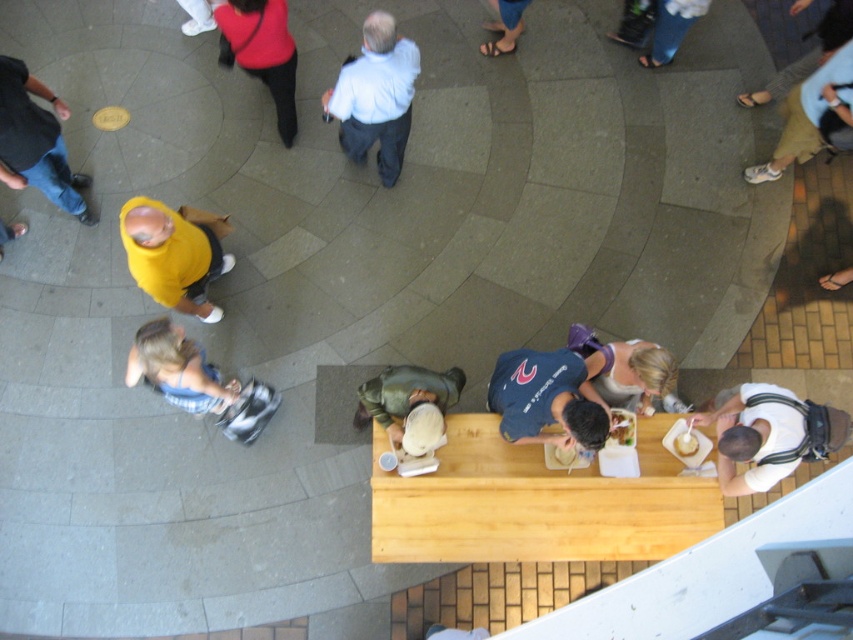
You are standing on the balcony looking down at the public square. You notice the denim shorts at lower left and the white paper cupcake at lower right. Which object is closer to you?

The denim shorts at lower left is closer to the viewer than the white paper cupcake at lower right.

You are standing on the balcony looking down at the public square. You notice a white cotton shirt at lower right and a blonde hair woman at center. Which one appears bigger in size?

The white cotton shirt at lower right has a larger size compared to the blonde hair woman at center.

You are standing at the edge of the public square and see the point marked at coordinates (405, 396). What object is located at that point?

The point at coordinates (405, 396) indicates the green fabric jacket at center.